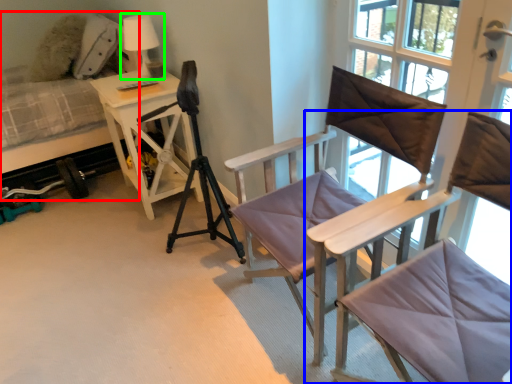
Question: Considering the real-world distances, which object is closest to hospital bed (highlighted by a red box)? chair (highlighted by a blue box) or table lamp (highlighted by a green box).

Choices:
 (A) chair
 (B) table lamp

Answer: (B)